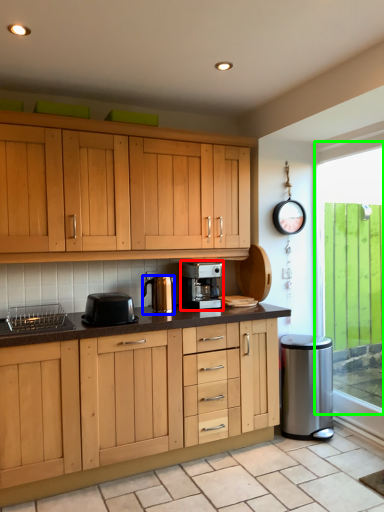
Question: Which object is the farthest from home appliance (highlighted by a red box)? Choose among these: kitchen appliance (highlighted by a blue box) or window (highlighted by a green box).

Choices:
 (A) kitchen appliance
 (B) window

Answer: (B)